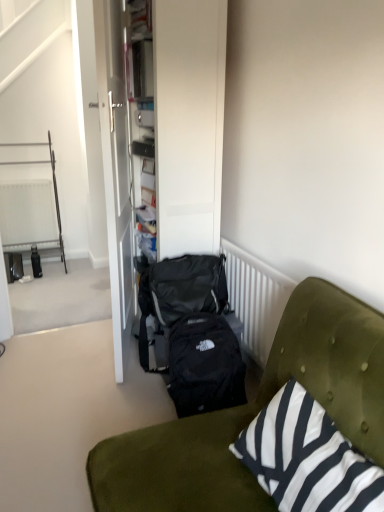
You are a GUI agent. You are given a task and a screenshot of the screen. Output one action in this format:
    pyautogui.click(x=<x>, y=<y>)
    Task: Click on the free space to the right of metal/textured rack at left
    The height and width of the screenshot is (512, 384).
    Given the screenshot: What is the action you would take?
    pyautogui.click(x=75, y=267)